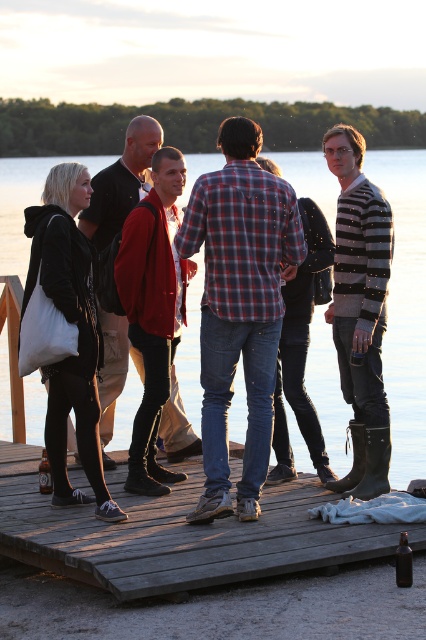
Question: Is transparent water at center smaller than red sweater at center?

Choices:
 (A) no
 (B) yes

Answer: (A)

Question: In this image, where is transparent water at center located relative to plaid fabric shirt at center?

Choices:
 (A) above
 (B) below

Answer: (A)

Question: Estimate the real-world distances between objects in this image. Which object is closer to the striped sweater at right?

Choices:
 (A) transparent water at center
 (B) wooden dock at center
 (C) plaid fabric shirt at center
 (D) red sweater at center

Answer: (C)

Question: Where is striped sweater at right located in relation to matte black jacket at left in the image?

Choices:
 (A) left
 (B) right

Answer: (B)

Question: Among these objects, which one is nearest to the camera?

Choices:
 (A) transparent water at center
 (B) matte black jacket at left

Answer: (B)

Question: Based on their relative distances, which object is farther from the matte black jacket at left?

Choices:
 (A) plaid fabric shirt at center
 (B) wooden dock at center
 (C) red sweater at center
 (D) transparent water at center

Answer: (D)